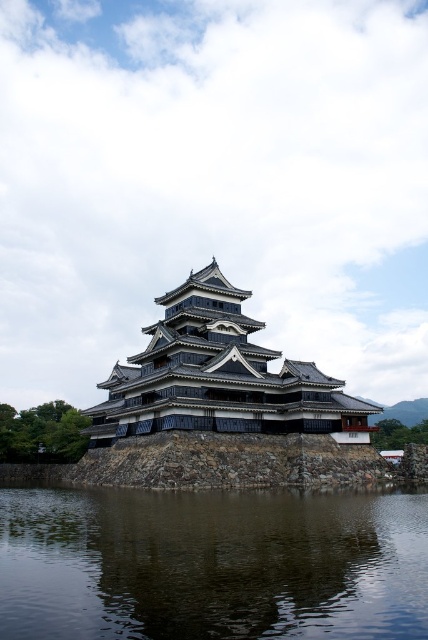
Describe the element at coordinates (211, 564) in the screenshot. I see `dark reflective water at center` at that location.

Is point (238, 540) positioned behind point (368, 481)?

No, (238, 540) is closer to viewer.

Identify the location of dark reflective water at center. The image size is (428, 640). (211, 564).